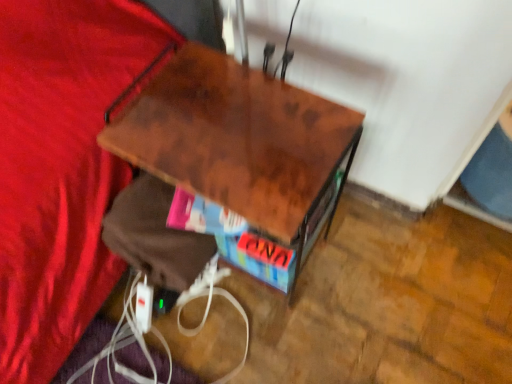
Locate an element on the screen. The width and height of the screenshot is (512, 384). free space above wooden desk at center (from a real-world perspective) is located at coordinates (234, 122).